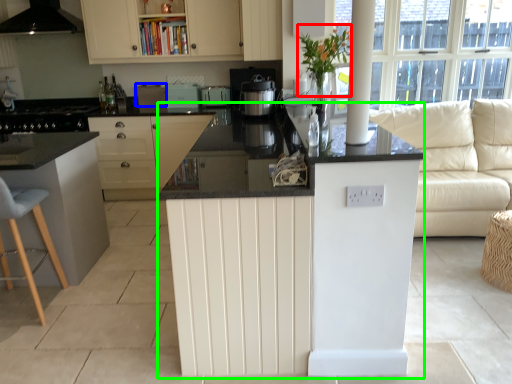
Question: Based on their relative distances, which object is nearer to plant (highlighted by a red box)? Choose from appliance (highlighted by a blue box) and counter (highlighted by a green box).

Choices:
 (A) appliance
 (B) counter

Answer: (B)